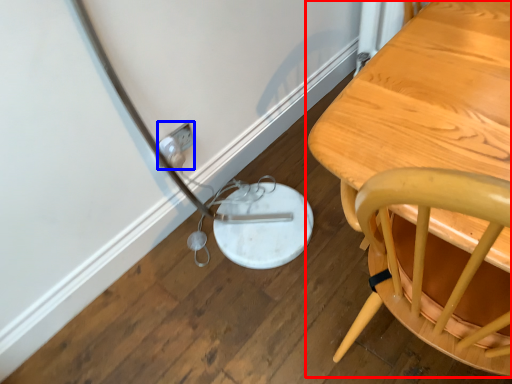
Question: Which of the following is the closest to the observer, table (highlighted by a red box) or electric outlet (highlighted by a blue box)?

Choices:
 (A) table
 (B) electric outlet

Answer: (A)